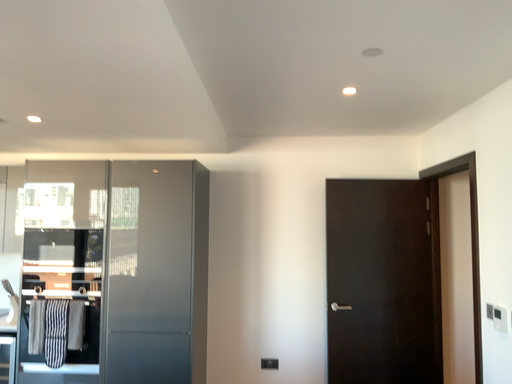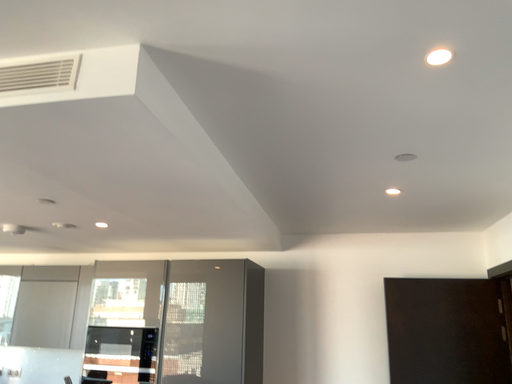
Question: Which way did the camera rotate in the video?

Choices:
 (A) rotated left
 (B) rotated right

Answer: (A)